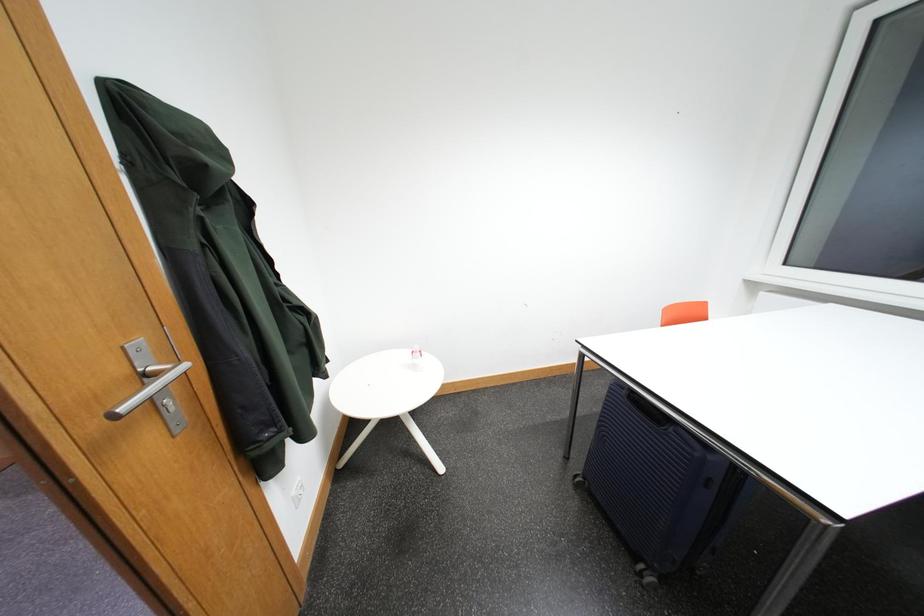
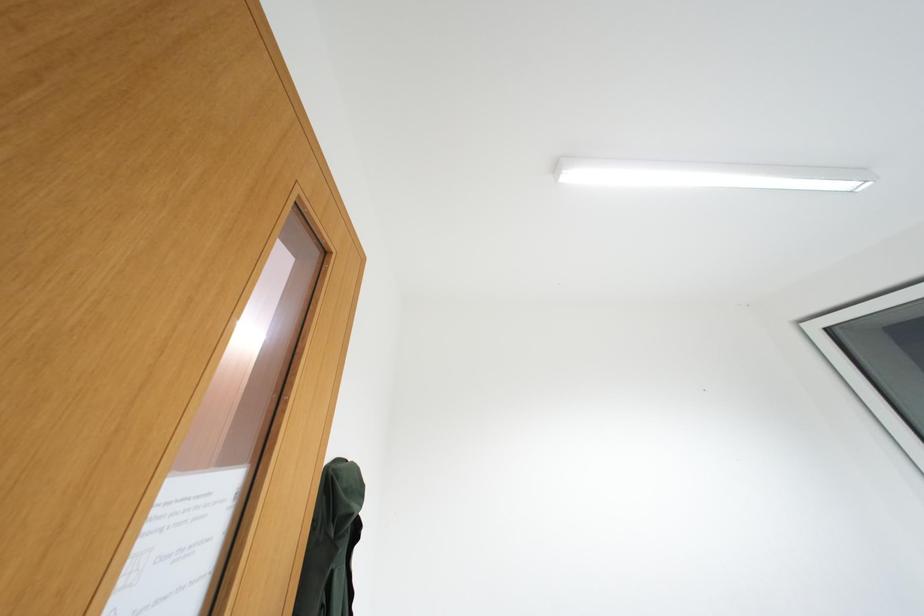
Question: The first image is from the beginning of the video and the second image is from the end. How did the camera likely rotate when shooting the video?

Choices:
 (A) Left
 (B) Right
 (C) Up
 (D) Down

Answer: (C)